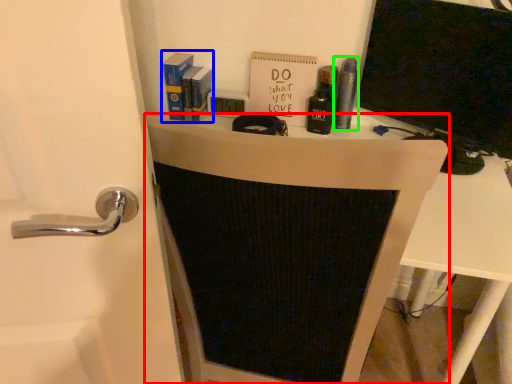
Question: Which is farther away from furniture (highlighted by a red box)? book (highlighted by a blue box) or toiletry (highlighted by a green box)?

Choices:
 (A) book
 (B) toiletry

Answer: (A)